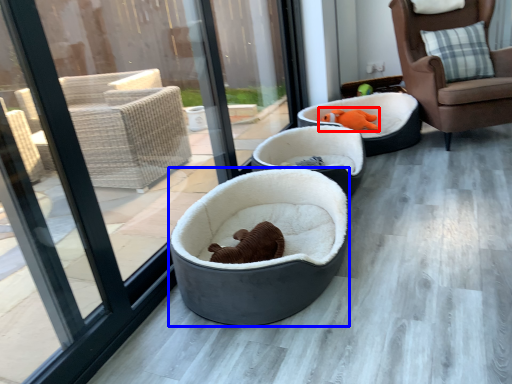
Question: Which point is further to the camera, animal (highlighted by a red box) or dog bed (highlighted by a blue box)?

Choices:
 (A) animal
 (B) dog bed

Answer: (A)